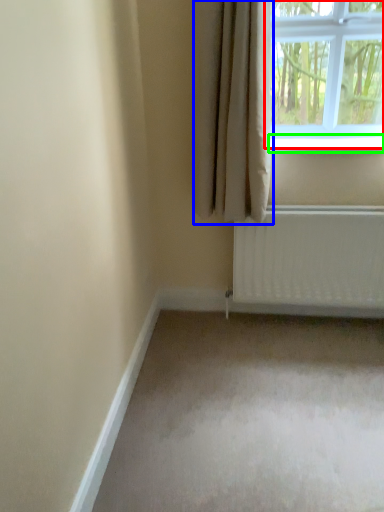
Question: Which is nearer to the window (highlighted by a red box)? curtain (highlighted by a blue box) or window sill (highlighted by a green box).

Choices:
 (A) curtain
 (B) window sill

Answer: (B)